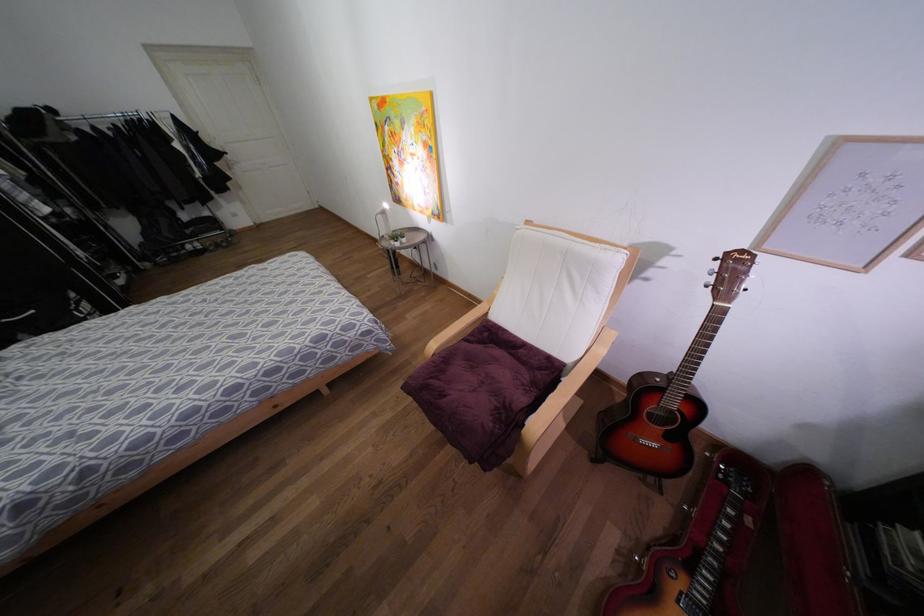
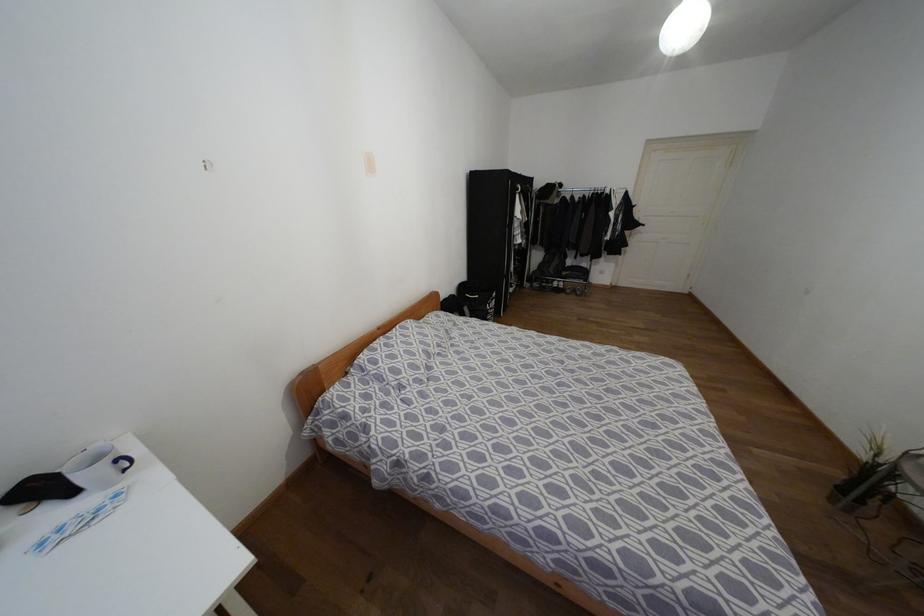
The point at (71, 294) is marked in the first image. Where is the corresponding point in the second image?

(493, 294)